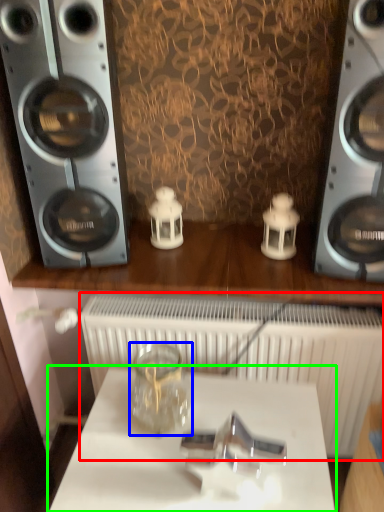
Question: Which object is the farthest from radiator (highlighted by a red box)? Choose among these: glass jar (highlighted by a blue box) or table (highlighted by a green box).

Choices:
 (A) glass jar
 (B) table

Answer: (B)